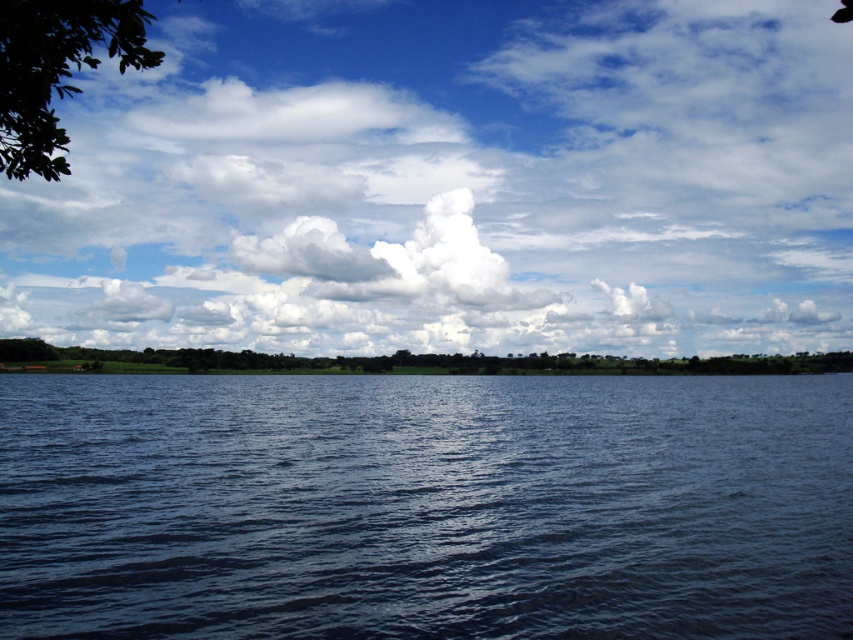
Does point (62, 52) lie behind point (844, 358)?

No, (62, 52) is closer to viewer.

Which is behind, point (76, 19) or point (254, 369)?

Positioned behind is point (254, 369).

Between point (0, 132) and point (608, 356), which one is positioned behind?

The point (608, 356) is more distant.

What are the coordinates of `green leafy tree at upper left` in the screenshot? It's located at (56, 70).

Who is taller, dark blue water at center or green leafy tree at center?

Standing taller between the two is green leafy tree at center.

This screenshot has width=853, height=640. Identify the location of dark blue water at center. (425, 506).

Where is `dark blue water at center`? Image resolution: width=853 pixels, height=640 pixels. dark blue water at center is located at coordinates (425, 506).

Between blue sky at upper center and dark blue water at center, which one appears on the left side from the viewer's perspective?

dark blue water at center is more to the left.

From the picture: Between blue sky at upper center and dark blue water at center, which one is positioned higher?

blue sky at upper center is above.

Between point (83, 316) and point (334, 428), which one is positioned in front?

Point (334, 428) is more forward.

Identify the location of blue sky at upper center. This screenshot has height=640, width=853. (451, 182).